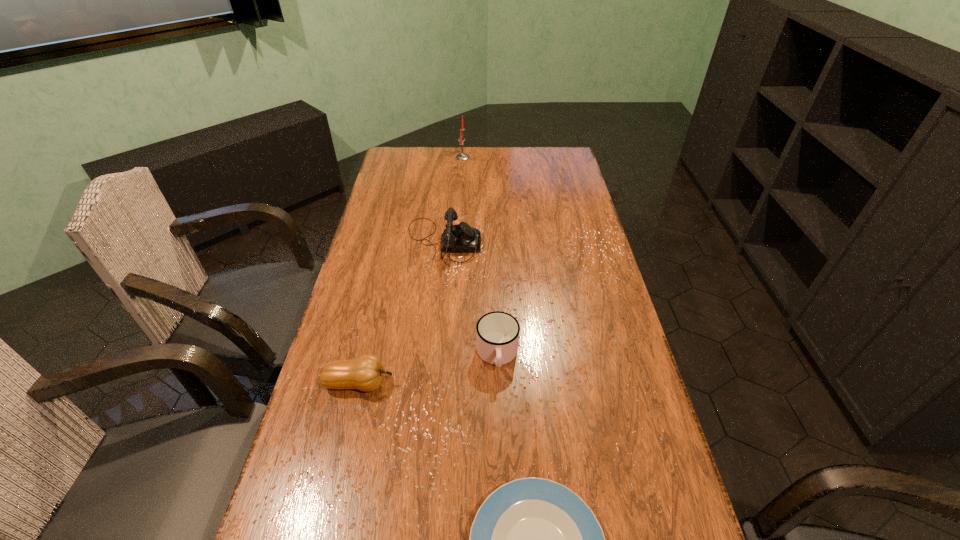
Find the location of a particular element. Image resolution: width=960 pixels, height=540 pixels. telephone that is at the left edge is located at coordinates coord(461,238).

Locate an element on the screen. This screenshot has width=960, height=540. gourd at the left edge is located at coordinates (366, 373).

In the image, there is a desktop. At what (x,y) coordinates should I click in order to perform the action: click on free space at the left edge. Please return your answer as a coordinate pair (x, y). This screenshot has height=540, width=960. Looking at the image, I should click on (397, 180).

You are a GUI agent. You are given a task and a screenshot of the screen. Output one action in this format:
    pyautogui.click(x=<x>, y=<y>)
    Task: Click on the blank space at the right edge of the desktop
    This screenshot has width=960, height=540.
    Given the screenshot: What is the action you would take?
    pyautogui.click(x=564, y=256)

This screenshot has height=540, width=960. Find the location of `blank space at the far left corner of the desktop`. blank space at the far left corner of the desktop is located at coordinates (389, 174).

Identify the location of vacant region between the gourd and the telephone. (401, 313).

Locate an element on the screen. free area in between the tallest object and the gourd is located at coordinates (411, 271).

Where is `empty space between the candle and the gourd`? The image size is (960, 540). empty space between the candle and the gourd is located at coordinates (411, 271).

Locate an element on the screen. This screenshot has width=960, height=540. free space between the second farthest object and the farthest object is located at coordinates (453, 199).

This screenshot has width=960, height=540. I want to click on object that ranks as the fourth closest to the mug, so click(x=462, y=156).